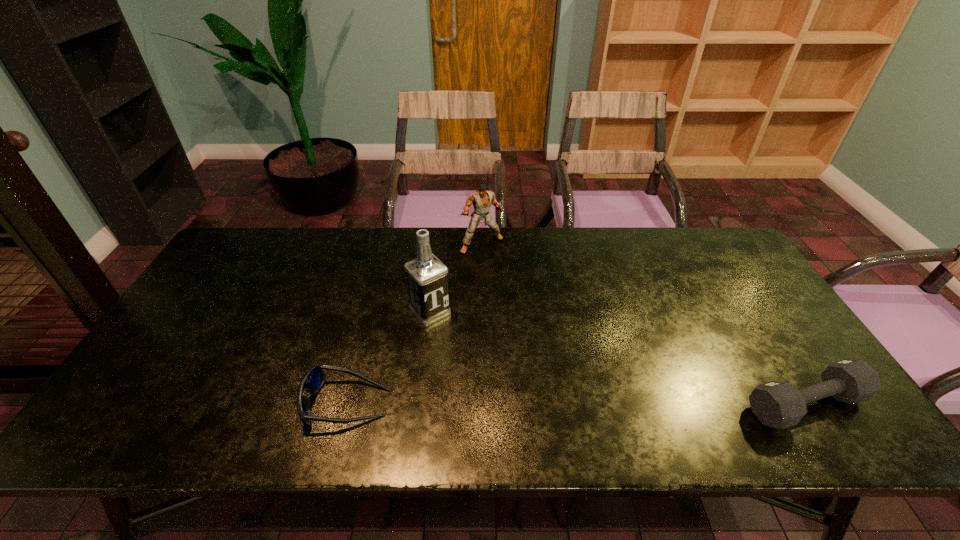
Identify the location of dumbbell that is at the near edge. (780, 405).

What are the coordinates of `object that is positioned at the right edge` in the screenshot? It's located at (780, 405).

You are a GUI agent. You are given a task and a screenshot of the screen. Output one action in this format:
    pyautogui.click(x=<x>, y=<y>)
    Task: Click on the object present at the near right corner
    The height and width of the screenshot is (540, 960).
    Given the screenshot: What is the action you would take?
    pyautogui.click(x=780, y=405)

At what (x,y) coordinates should I click in order to perform the action: click on free space at the far edge of the desktop. Please return your answer as a coordinate pair (x, y). Looking at the image, I should click on (338, 238).

The width and height of the screenshot is (960, 540). Find the location of `blank space at the near edge`. blank space at the near edge is located at coordinates (275, 401).

Image resolution: width=960 pixels, height=540 pixels. In the image, there is a desktop. Find the location of `vacant area at the left edge`. vacant area at the left edge is located at coordinates (159, 363).

At what (x,y) coordinates should I click in order to perform the action: click on vacant region at the right edge. Please return your answer as a coordinate pair (x, y). This screenshot has height=540, width=960. Looking at the image, I should click on (733, 329).

The width and height of the screenshot is (960, 540). Find the location of `vacant region at the far left corner of the desktop`. vacant region at the far left corner of the desktop is located at coordinates (256, 241).

In the image, there is a desktop. Find the location of `free space at the far right corner`. free space at the far right corner is located at coordinates (732, 267).

I want to click on unoccupied area between the third shortest object and the dumbbell, so click(643, 324).